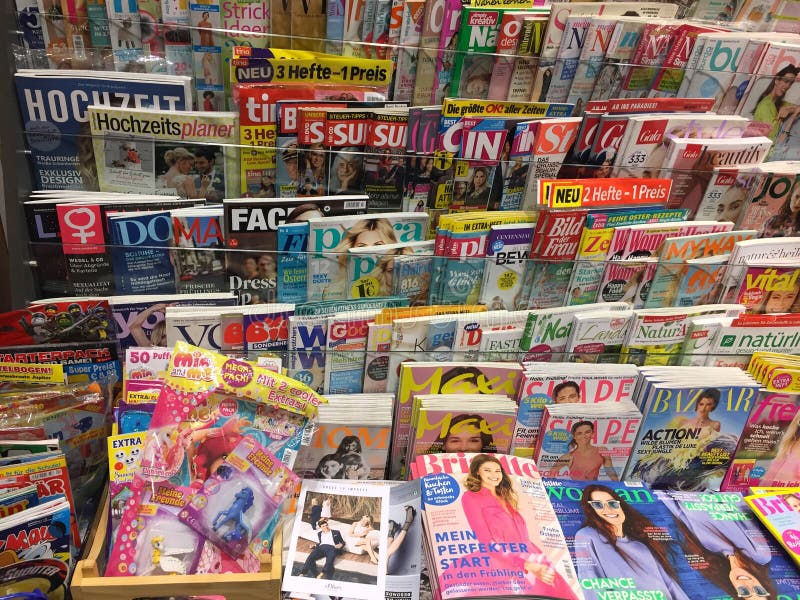
Locate an element on the screen. The image size is (800, 600). magazines piled in front of the front rack is located at coordinates (413, 527).